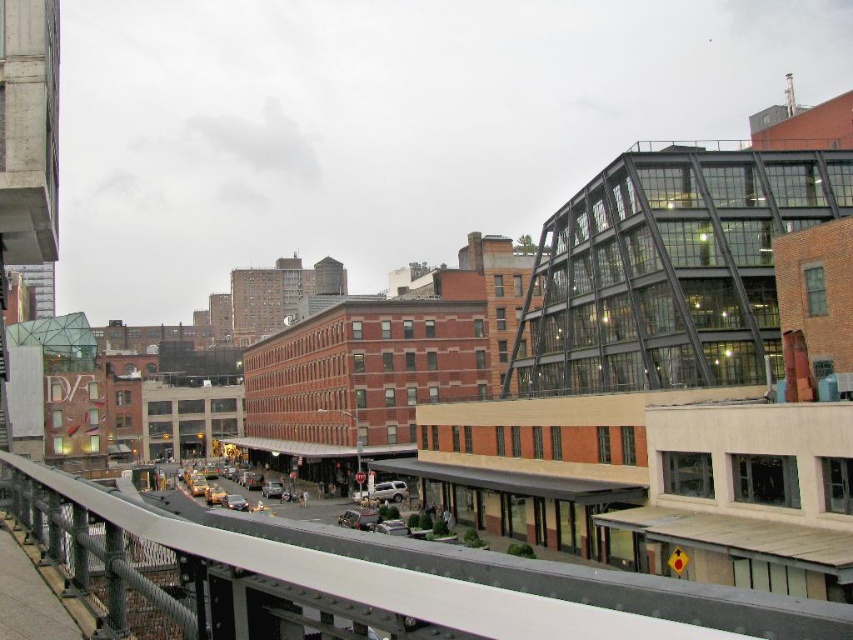
Does silver metallic suv at center have a smaller size compared to silver metallic car at lower center?

Correct, silver metallic suv at center occupies less space than silver metallic car at lower center.

Can you confirm if silver metallic suv at center is positioned to the right of silver metallic car at lower center?

Correct, you'll find silver metallic suv at center to the right of silver metallic car at lower center.

Is point (405, 492) in front of point (241, 508)?

No, it is not.

I want to click on silver metallic suv at center, so click(387, 492).

Is silver metallic car at lower center below yellow rubber car at center?

Actually, silver metallic car at lower center is above yellow rubber car at center.

Which is below, silver metallic car at lower center or yellow rubber car at center?

Positioned lower is yellow rubber car at center.

Is point (224, 504) positioned behind point (202, 483)?

That is False.

Locate an element on the screen. Image resolution: width=853 pixels, height=640 pixels. silver metallic car at lower center is located at coordinates (235, 502).

Between metallic silver car at center and yellow rubber car at center, which one appears on the right side from the viewer's perspective?

Positioned to the right is metallic silver car at center.

Who is shorter, metallic silver car at center or yellow rubber car at center?

With less height is yellow rubber car at center.

This screenshot has width=853, height=640. What are the coordinates of `metallic silver car at center` in the screenshot? It's located at (271, 490).

Identify the location of metallic silver car at center. (271, 490).